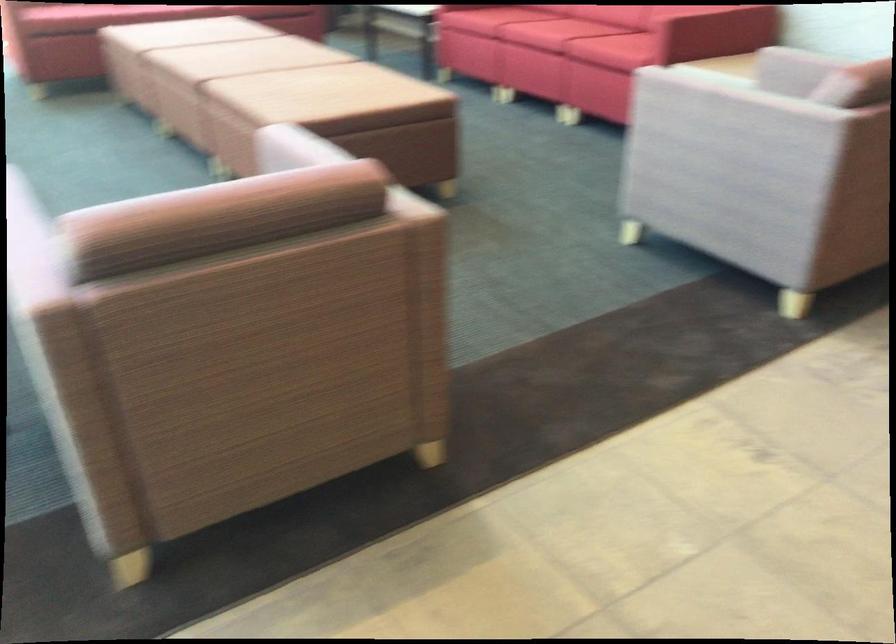
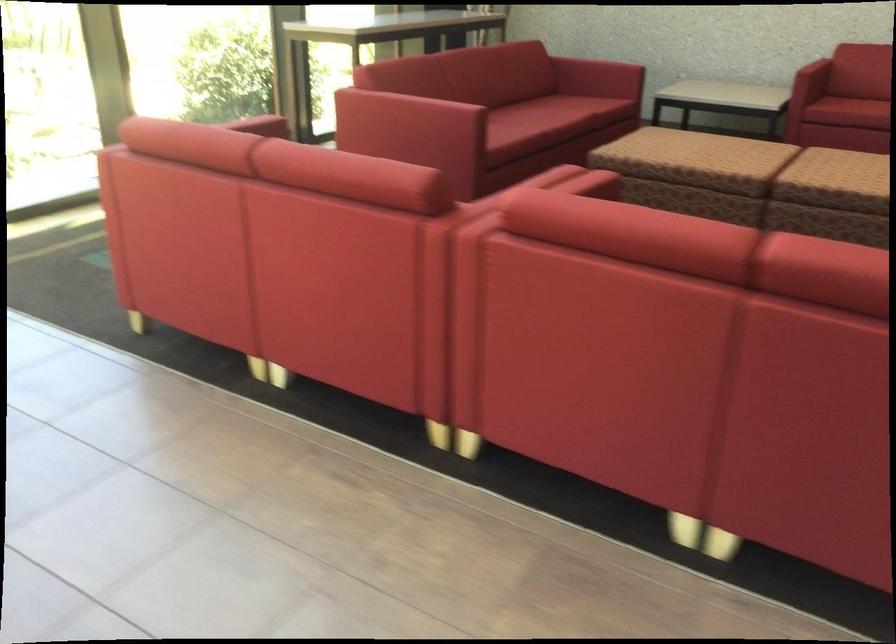
How did the camera likely rotate?

The rotation direction of the camera is right-down.